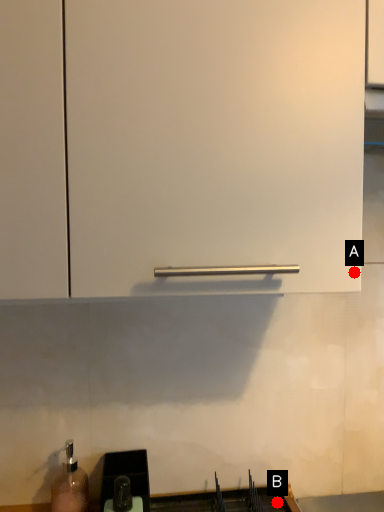
Question: Two points are circled on the image, labeled by A and B beside each circle. Which point appears farthest from the camera in this image?

Choices:
 (A) A is further
 (B) B is further

Answer: (B)